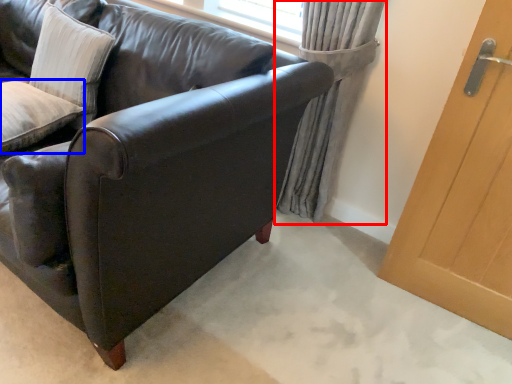
Question: Which point is closer to the camera, curtain (highlighted by a red box) or pillow (highlighted by a blue box)?

Choices:
 (A) curtain
 (B) pillow

Answer: (B)